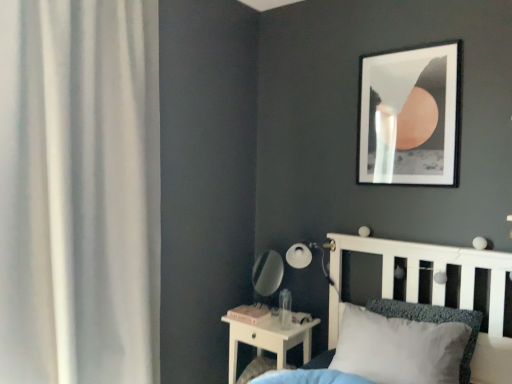
Question: Is white sheer curtain at left taller or shorter than shiny silver mirror at center?

Choices:
 (A) tall
 (B) short

Answer: (A)

Question: Is white sheer curtain at left in front of or behind shiny silver mirror at center in the image?

Choices:
 (A) behind
 (B) front

Answer: (B)

Question: Which of these objects is positioned closest to the white matte bed at center?

Choices:
 (A) white soft pillow at center
 (B) white sheer curtain at left
 (C) matte black picture frame at upper right
 (D) matte black table lamp at upper right
 (E) shiny silver mirror at center

Answer: (A)

Question: Which is nearer to the white soft pillow at center?

Choices:
 (A) matte black table lamp at upper right
 (B) white sheer curtain at left
 (C) white wood nightstand at lower center
 (D) matte black picture frame at upper right
 (E) shiny silver mirror at center

Answer: (A)